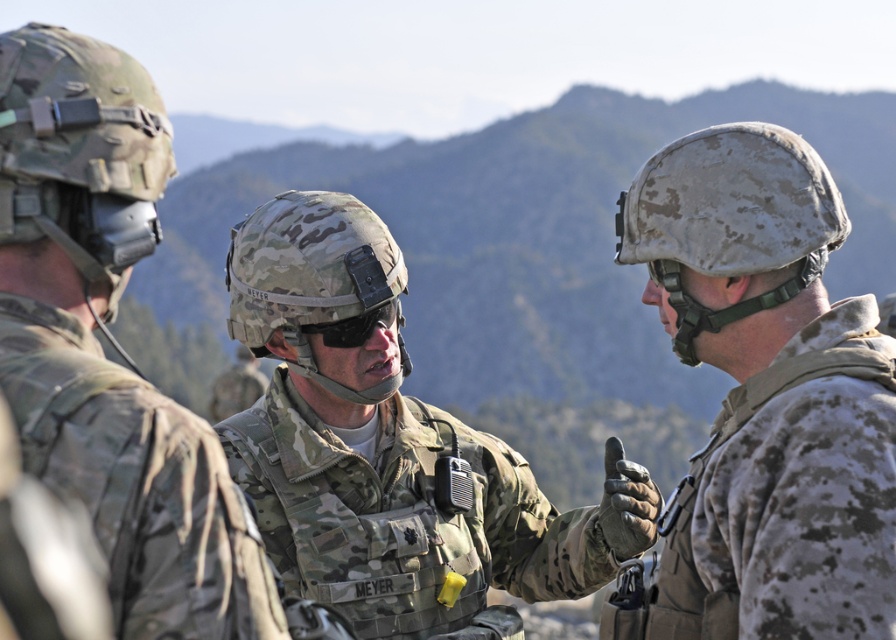
Does point (876, 403) lie in front of point (69, 410)?

No, (876, 403) is behind (69, 410).

Who is positioned more to the right, camouflage uniform at right or camouflage uniform at left?

camouflage uniform at right is more to the right.

Is point (882, 392) less distant than point (74, 67)?

That is False.

Find the location of a particular element. This screenshot has width=896, height=640. camouflage uniform at right is located at coordinates (768, 394).

Between camo uniform at center and camouflage uniform at left, which one appears on the right side from the viewer's perspective?

camo uniform at center

In order to click on camo uniform at center in this screenshot , I will do `click(389, 444)`.

Which is behind, point (427, 636) or point (42, 476)?

Point (427, 636)

The image size is (896, 640). In order to click on camo uniform at center in this screenshot , I will do `click(389, 444)`.

This screenshot has width=896, height=640. Describe the element at coordinates (768, 394) in the screenshot. I see `camouflage uniform at right` at that location.

Find the location of a particular element. This screenshot has height=640, width=896. camouflage uniform at right is located at coordinates (768, 394).

Where is `camouflage uniform at right`? camouflage uniform at right is located at coordinates (768, 394).